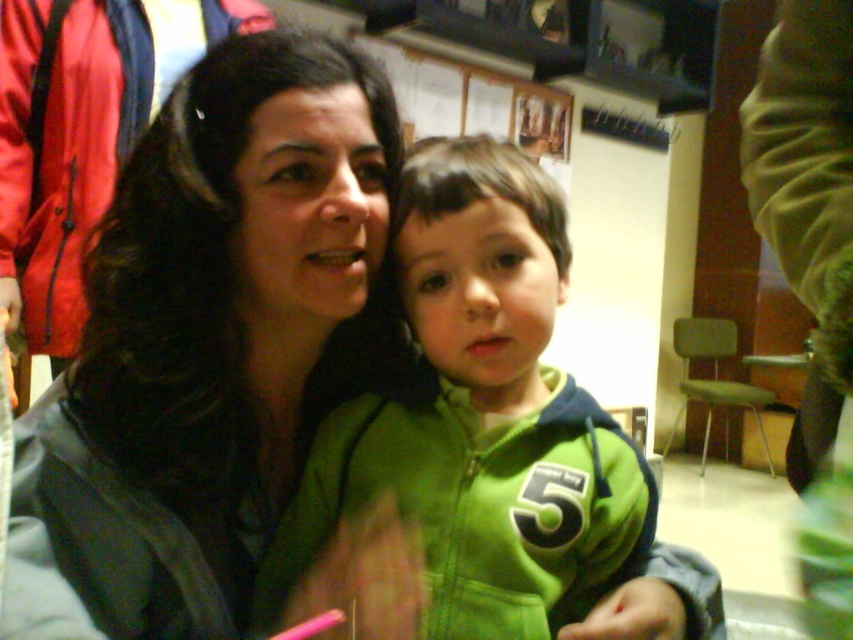
You are standing in a room and see the matte black jacket at upper left. If you want to reach it without moving your feet, is it within arm reach?

The matte black jacket at upper left is 22.32 inches away from the viewer. Since the average arm reach is about 24 inches, it is within arm reach.

You are taking a photo of two points in the scene. The first point is at coordinate point (103, 496) and the second point is at coordinate point (80, 65). Which point is closer to the camera?

Point (103, 496) is closer to the camera than point (80, 65).